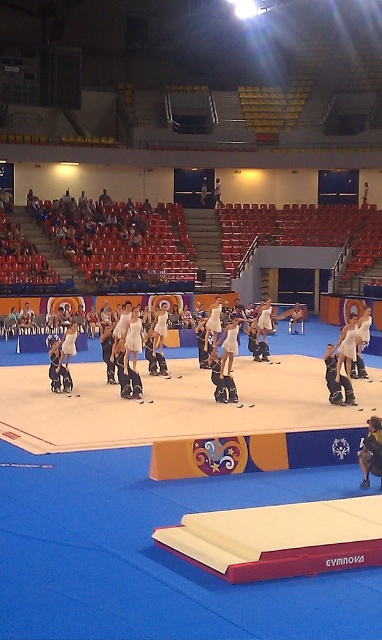
Based on the photo, you are a judge observing the gymnastics performance. You notice two gymnasts at the center of the platform. Which one is positioned closer to you, the matte black gymnastics suit at center or the white fabric gymnast at center?

The matte black gymnastics suit at center is closer to the viewer than the white fabric gymnast at center.

You are a photographer positioned at the front of the arena. You want to capture a closeup shot of the gymnast located at point (x=351, y=392) and another gymnast at point (x=218, y=205). Which gymnast will appear larger in your photo?

The gymnast located at point (x=351, y=392) will appear larger in the photo because it is closer to the camera than point (x=218, y=205).